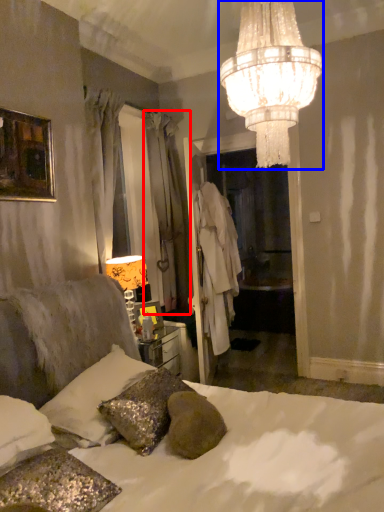
Question: Which object appears farthest to the camera in this image, curtain (highlighted by a red box) or lamp (highlighted by a blue box)?

Choices:
 (A) curtain
 (B) lamp

Answer: (A)